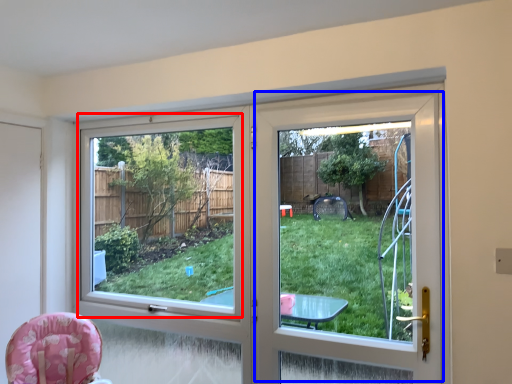
Question: Which object is closer to the camera taking this photo, window screen (highlighted by a red box) or screen door (highlighted by a blue box)?

Choices:
 (A) window screen
 (B) screen door

Answer: (B)